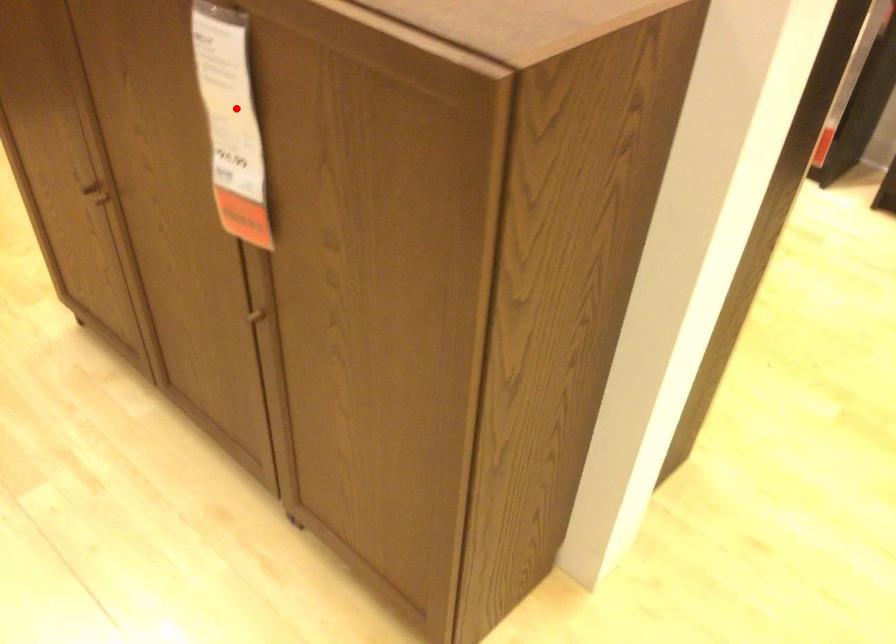
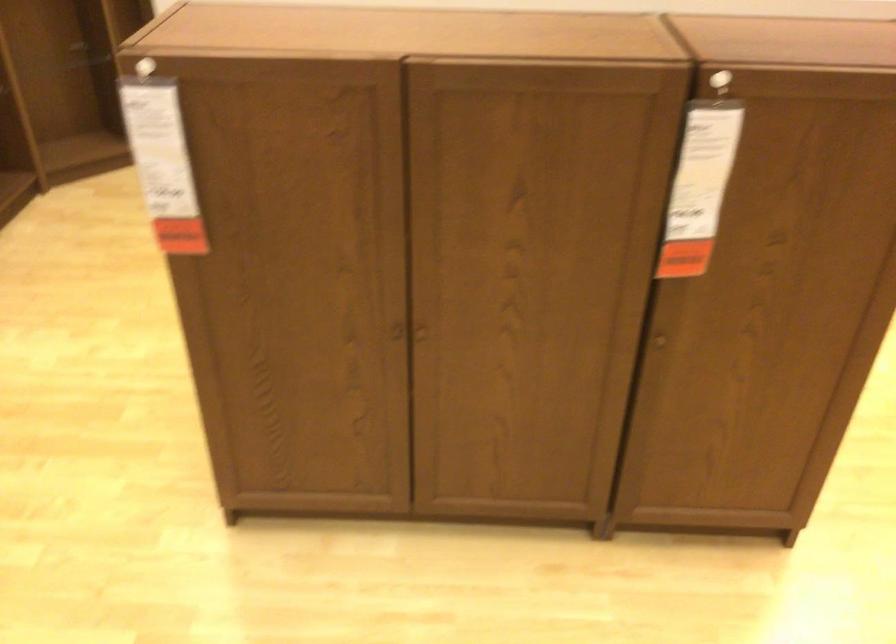
Question: I am providing you with two images of the same scene from different viewpoints. A red point is shown in image1. For the corresponding object point in image2, is it positioned nearer or farther from the camera?

Choices:
 (A) Nearer
 (B) Farther

Answer: (B)